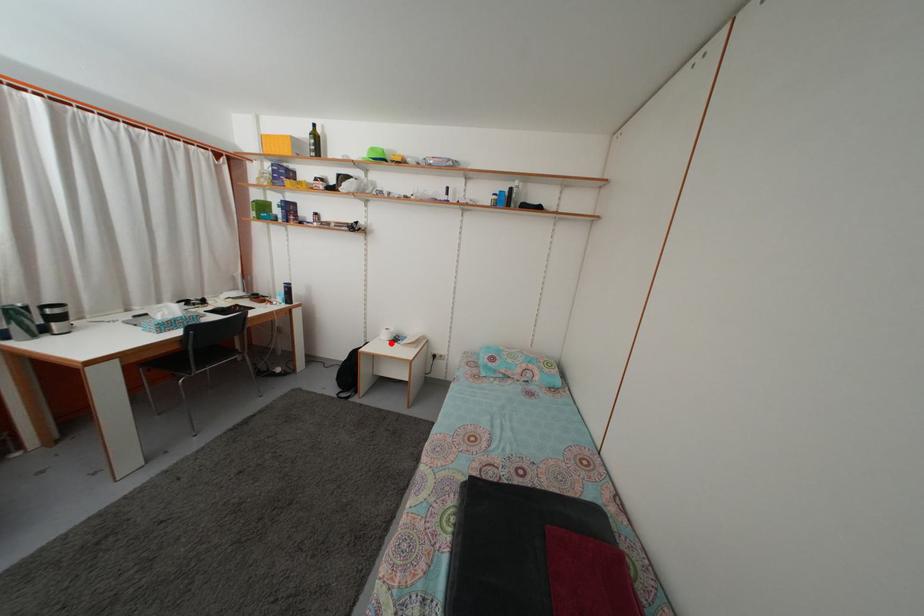
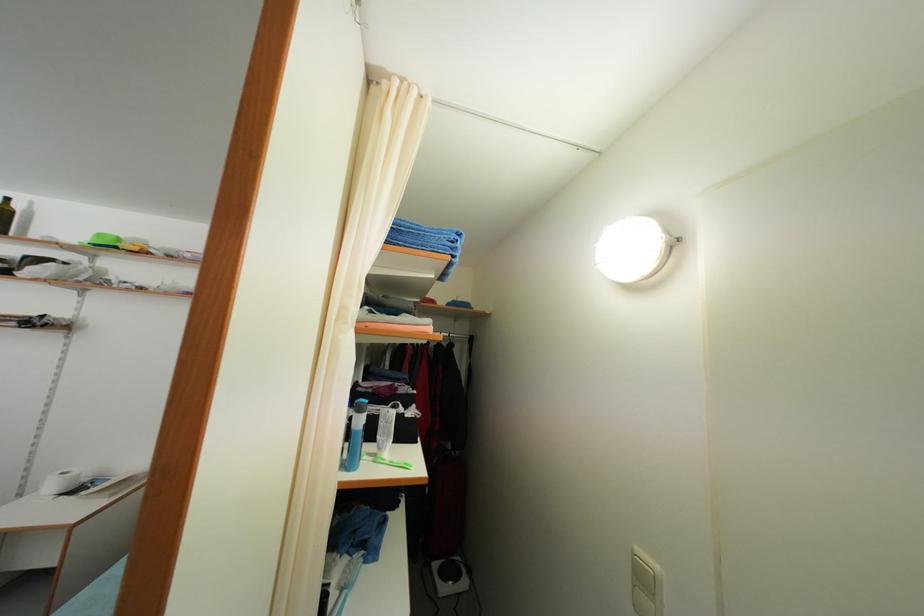
Question: A red point is marked in image1. In image2, is the corresponding 3D point closer to the camera or farther? Reply with the corresponding letter.

Choices:
 (A) The corresponding 3D point is closer.
 (B) The corresponding 3D point is farther.

Answer: (A)